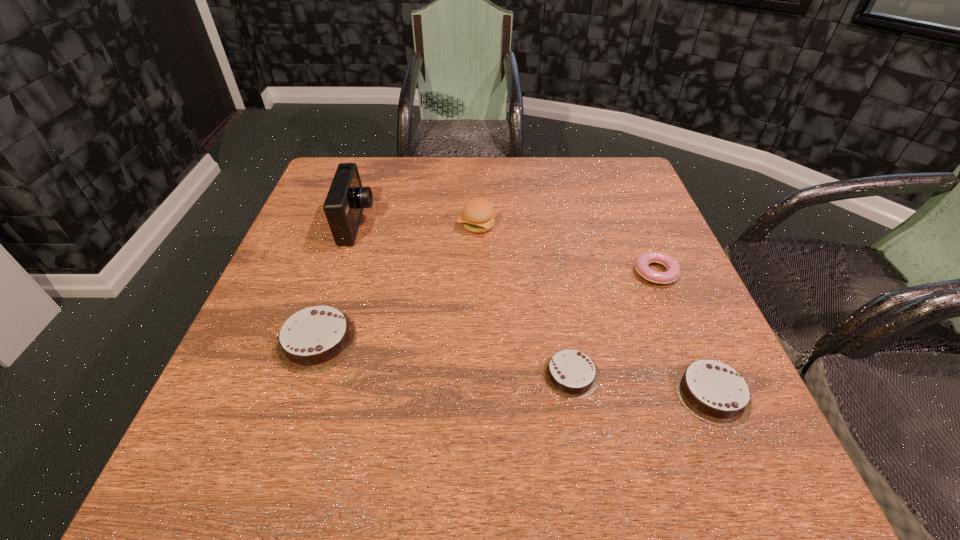
Image resolution: width=960 pixels, height=540 pixels. I want to click on free space located 0.150m on the right of the shortest chocolate cake, so click(684, 374).

At what (x,y) coordinates should I click in order to perform the action: click on vacant region located 0.180m on the left of the second shortest chocolate cake. Please return your answer as a coordinate pair (x, y). Looking at the image, I should click on (569, 393).

Where is `free location located on the front-facing side of the camera`? The image size is (960, 540). free location located on the front-facing side of the camera is located at coordinates (495, 224).

The width and height of the screenshot is (960, 540). Identify the location of blank area located 0.390m on the left of the third object from left to right. (300, 225).

Where is `free space located on the left of the fourth nearest object`? free space located on the left of the fourth nearest object is located at coordinates (483, 273).

At what (x,y) coordinates should I click in order to perform the action: click on object located in the far edge section of the desktop. Please return your answer as a coordinate pair (x, y). Looking at the image, I should click on (346, 199).

I want to click on chocolate cake located in the left edge section of the desktop, so click(x=314, y=339).

Identify the location of camera located in the left edge section of the desktop. [346, 199].

What are the coordinates of `chocolate cake that is at the right edge` in the screenshot? It's located at (714, 392).

Find the location of a particular element. Image resolution: width=960 pixels, height=540 pixels. doughnut that is at the right edge is located at coordinates (671, 265).